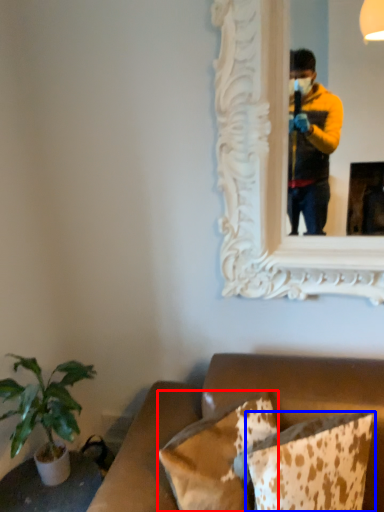
Question: Which point is further to the camera, pillow (highlighted by a red box) or pillow (highlighted by a blue box)?

Choices:
 (A) pillow
 (B) pillow

Answer: (A)